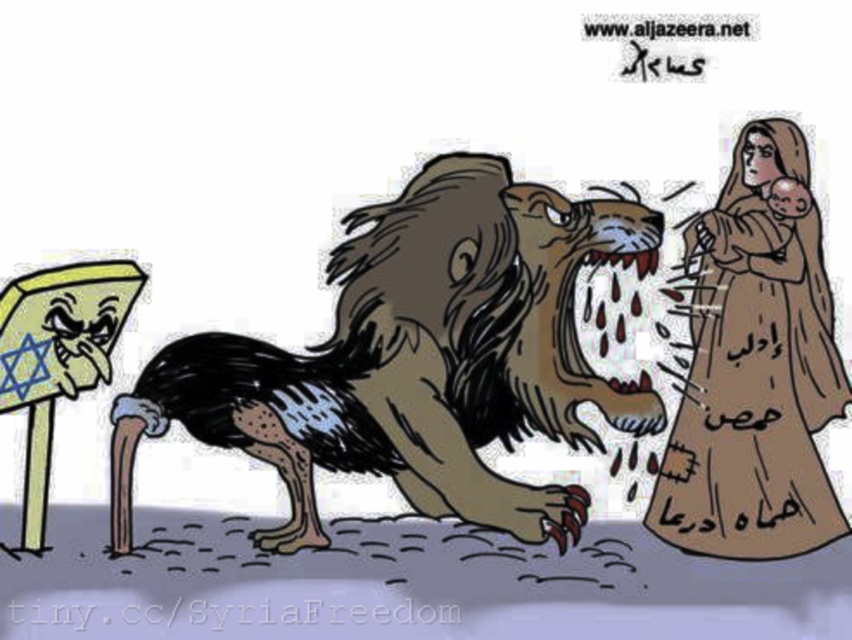
You are an observer analyzing this political cartoon. You notice the brown fabric person at right and the yellow paper sign at left. Based on their positions, which one is higher up in the image?

The brown fabric person at right is located above the yellow paper sign at left, so the brown fabric person at right is higher up in the image.